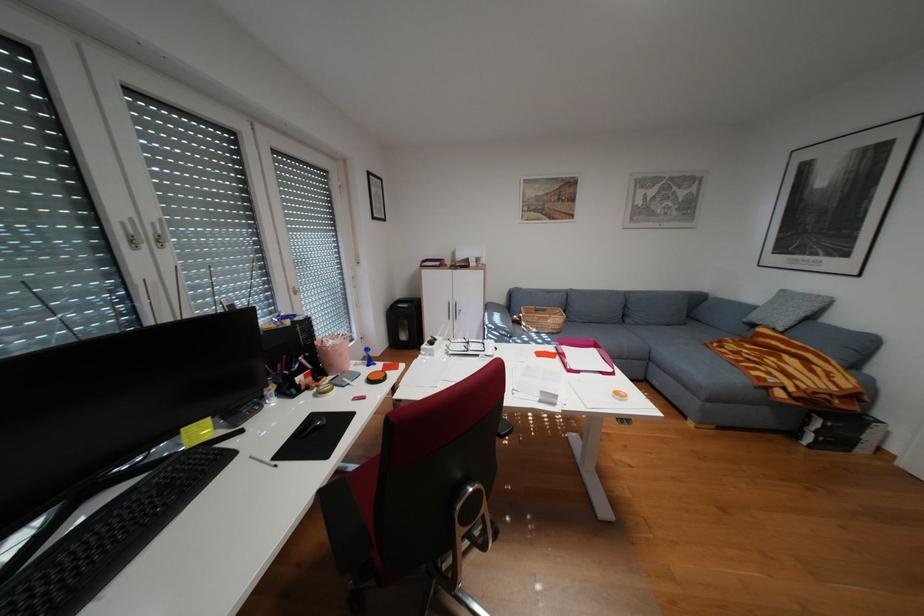
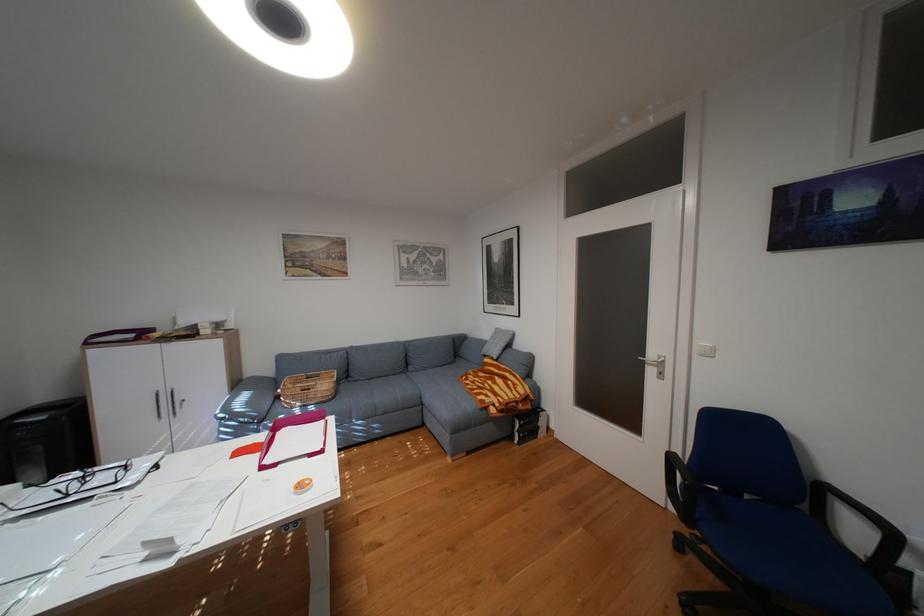
Locate, in the second image, the point that corresponds to [649,323] in the first image.

(430, 370)